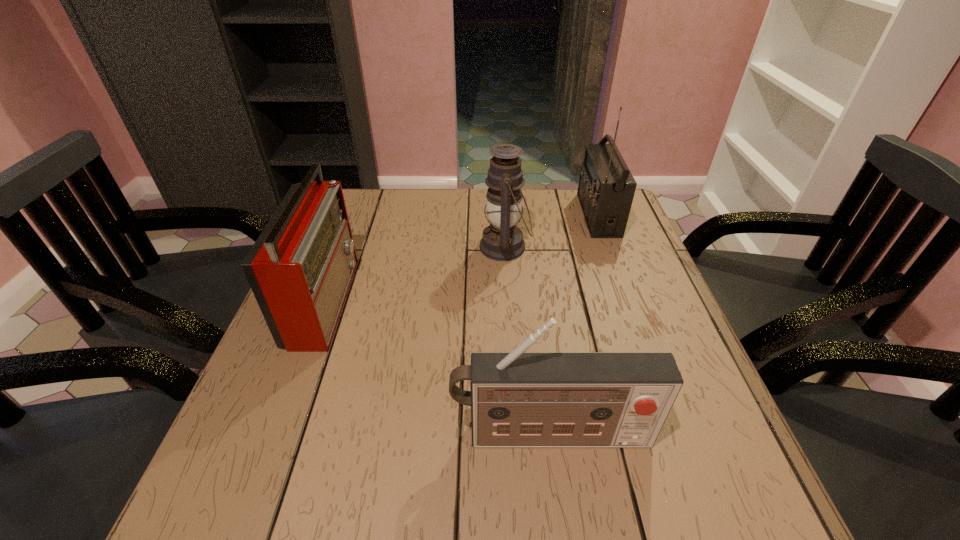
Where is `vacant area at the right edge of the desktop`? vacant area at the right edge of the desktop is located at coordinates [x=645, y=341].

This screenshot has height=540, width=960. Identify the location of vacant region at the near right corner of the desktop. (716, 479).

You are a GUI agent. You are given a task and a screenshot of the screen. Output one action in this format:
    pyautogui.click(x=<x>, y=<y>)
    Task: Click on the unoccupied area between the rightmost object and the second radio receiver from right to left
    This screenshot has width=960, height=540.
    Given the screenshot: What is the action you would take?
    pyautogui.click(x=574, y=325)

Locate an element on the screen. The height and width of the screenshot is (540, 960). empty space that is in between the rightmost object and the second radio receiver from left to right is located at coordinates (574, 325).

The width and height of the screenshot is (960, 540). I want to click on empty location between the oil lamp and the tallest radio receiver, so click(x=551, y=231).

The width and height of the screenshot is (960, 540). I want to click on vacant area that lies between the second farthest radio receiver and the nearest radio receiver, so click(438, 367).

Identify the location of empty space between the second radio receiver from right to left and the farthest radio receiver. Image resolution: width=960 pixels, height=540 pixels. (574, 325).

Where is `empty location between the nearest object and the farthest radio receiver`? This screenshot has width=960, height=540. empty location between the nearest object and the farthest radio receiver is located at coordinates (574, 325).

What are the coordinates of `blank region between the second radio receiver from left to right and the rightmost radio receiver` in the screenshot? It's located at 574,325.

The image size is (960, 540). Find the location of `free area in between the oil lamp and the rightmost object`. free area in between the oil lamp and the rightmost object is located at coordinates (551, 231).